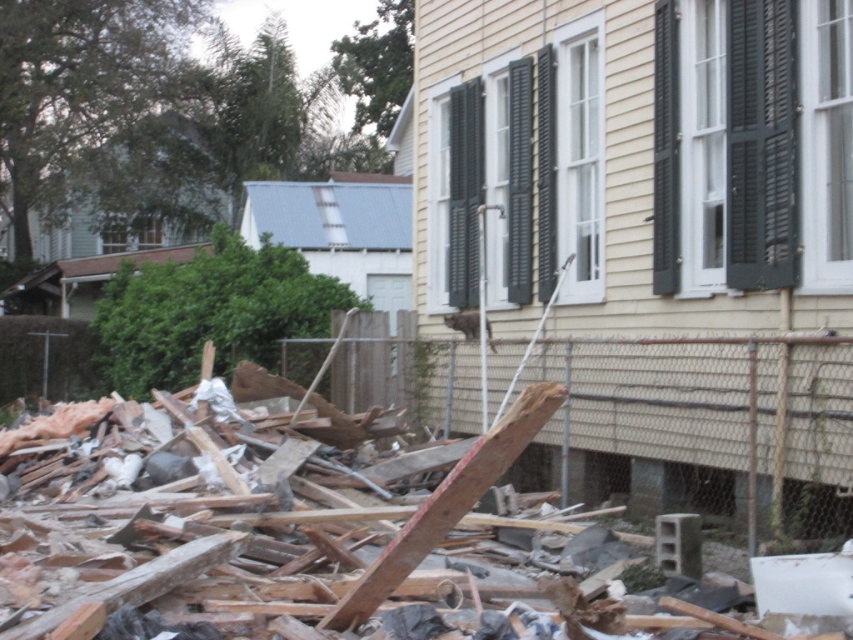
Is point (457, 349) in front of point (521, 116)?

No.

Between point (830, 365) and point (515, 138), which one is positioned behind?

The point (515, 138) is behind.

Who is more distant from viewer, [840,531] or [525,108]?

Point [525,108]

Locate an element on the screen. rusty metal fence at lower center is located at coordinates (712, 422).

Does rusty metal fence at lower center come behind black matte shutters at upper right?

Yes, rusty metal fence at lower center is further from the viewer.

Between rusty metal fence at lower center and black matte shutters at upper right, which one appears on the left side from the viewer's perspective?

rusty metal fence at lower center is more to the left.

The height and width of the screenshot is (640, 853). Describe the element at coordinates (712, 422) in the screenshot. I see `rusty metal fence at lower center` at that location.

Where is `rusty metal fence at lower center`? The height and width of the screenshot is (640, 853). rusty metal fence at lower center is located at coordinates [712, 422].

Who is taller, black matte shutters at upper right or black matte shutters at center?

black matte shutters at center is taller.

Between point (779, 120) and point (480, 168), which one is positioned in front?

Point (779, 120)

Is point (793, 58) positioned behind point (466, 186)?

No, (793, 58) is closer to viewer.

Find the location of a particular element. This screenshot has height=640, width=853. black matte shutters at upper right is located at coordinates (761, 145).